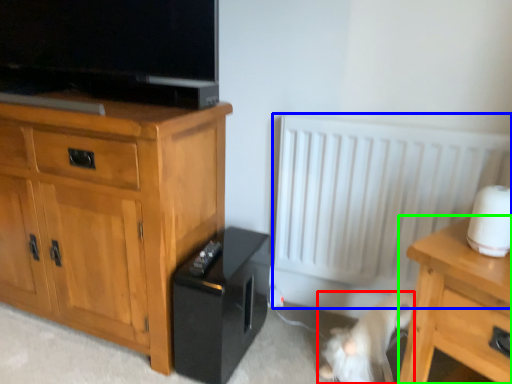
Question: Considering the real-world distances, which object is farthest from animal (highlighted by a red box)? radiator (highlighted by a blue box) or nightstand (highlighted by a green box)?

Choices:
 (A) radiator
 (B) nightstand

Answer: (A)